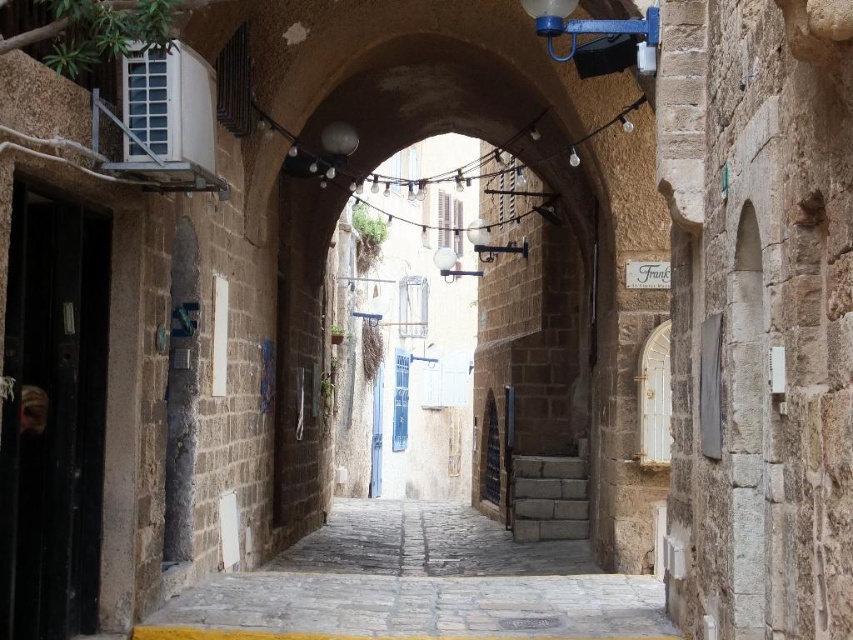
Question: Which object appears closest to the camera in this image?

Choices:
 (A) stone paved alley at center
 (B) brown stone archway at center

Answer: (A)

Question: Can you confirm if brown stone archway at center is wider than stone paved alley at center?

Choices:
 (A) yes
 (B) no

Answer: (A)

Question: Which of the following is the farthest from the observer?

Choices:
 (A) stone paved alley at center
 (B) brown stone archway at center

Answer: (B)

Question: Can you confirm if brown stone archway at center is thinner than stone paved alley at center?

Choices:
 (A) no
 (B) yes

Answer: (A)

Question: Which object is closer to the camera taking this photo?

Choices:
 (A) brown stone archway at center
 (B) stone paved alley at center

Answer: (B)

Question: Is brown stone archway at center thinner than stone paved alley at center?

Choices:
 (A) no
 (B) yes

Answer: (A)